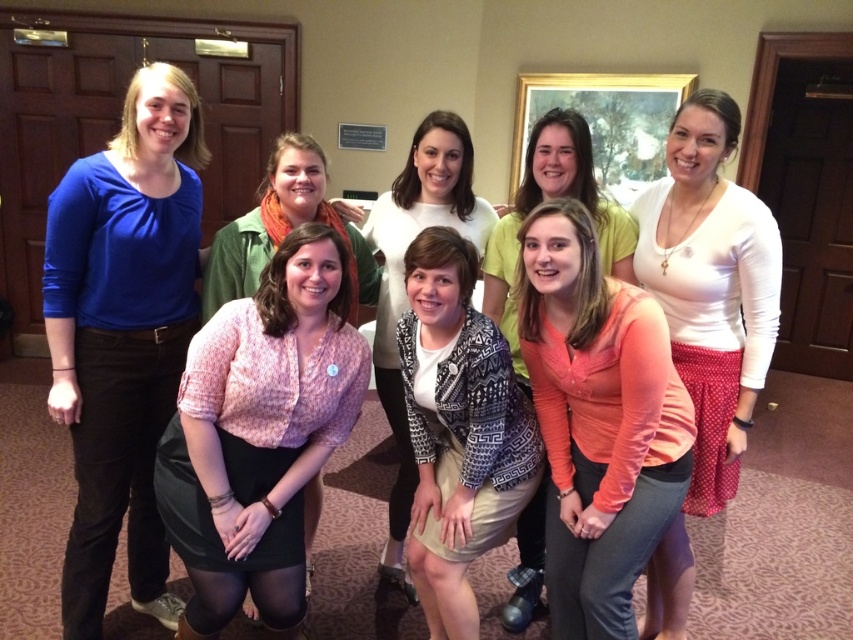
The height and width of the screenshot is (640, 853). What do you see at coordinates (123, 333) in the screenshot?
I see `matte blue blouse at upper left` at bounding box center [123, 333].

In the scene shown: Between matte blue blouse at upper left and pink textured blouse at center, which one appears on the left side from the viewer's perspective?

matte blue blouse at upper left is more to the left.

Does point (74, 275) come farther from viewer compared to point (218, 557)?

Yes, point (74, 275) is behind point (218, 557).

Where is `matte blue blouse at upper left`? This screenshot has width=853, height=640. matte blue blouse at upper left is located at coordinates (123, 333).

Does matte blue blouse at upper left appear on the right side of matte coral blouse at center?

No, matte blue blouse at upper left is not to the right of matte coral blouse at center.

Is point (90, 352) positioned before point (589, 150)?

Yes, it is.

Who is more distant from viewer, (103, 241) or (524, 584)?

Point (524, 584)

I want to click on matte blue blouse at upper left, so click(123, 333).

What do you see at coordinates (457, 429) in the screenshot? The image size is (853, 640). I see `patterned knit cardigan at center` at bounding box center [457, 429].

Does point (450, 378) lie behind point (508, 314)?

No, it is in front of (508, 314).

Where is `patterned knit cardigan at center`? patterned knit cardigan at center is located at coordinates (457, 429).